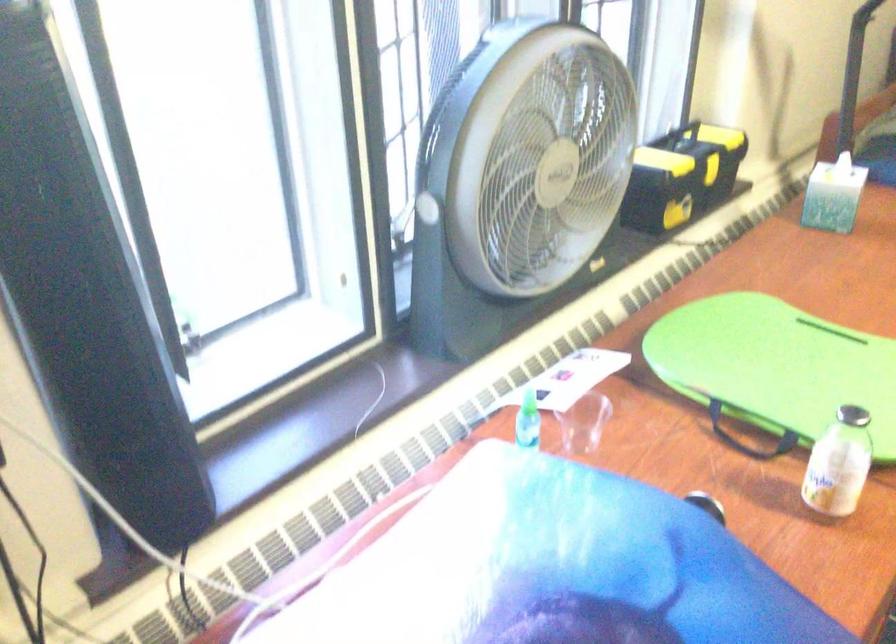
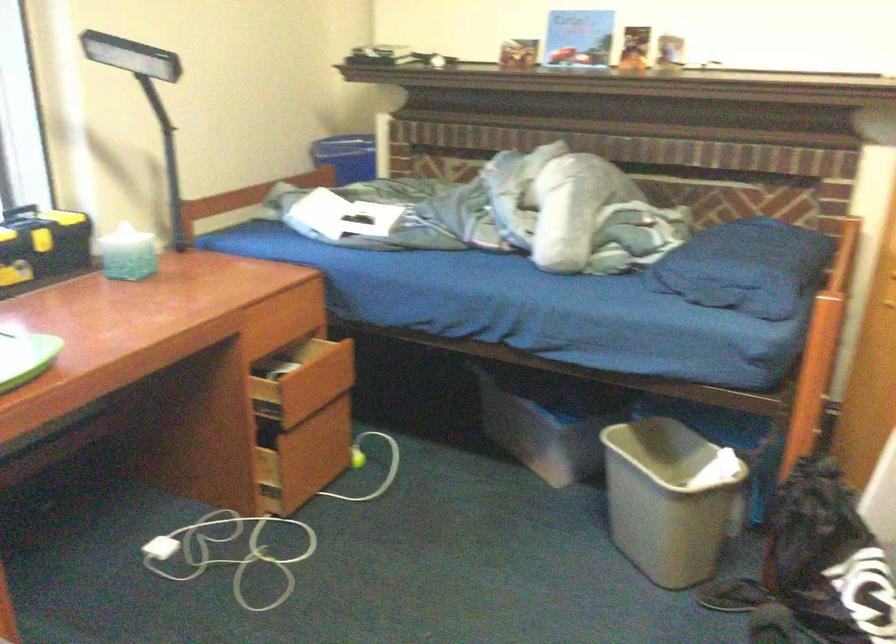
In the scene shown: Which direction would the cameraman need to move to produce the second image?

The cameraman walked toward right, backward.